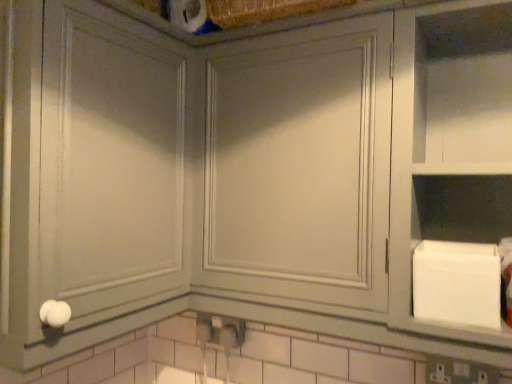
Question: Can you confirm if white matte cabinet at right is taller than matte gray cabinet at center, the first glass door when ordered from right to left?

Choices:
 (A) yes
 (B) no

Answer: (A)

Question: From a real-world perspective, is white matte cabinet at right physically above matte gray cabinet at center, which appears as the 2th glass door when viewed from the left?

Choices:
 (A) yes
 (B) no

Answer: (B)

Question: From the image's perspective, is white matte cabinet at right under matte gray cabinet at center, the first glass door when ordered from right to left?

Choices:
 (A) no
 (B) yes

Answer: (B)

Question: Is white matte cabinet at right positioned in front of matte gray cabinet at center, which appears as the 2th glass door when viewed from the left?

Choices:
 (A) no
 (B) yes

Answer: (B)

Question: Considering the relative sizes of white matte cabinet at right and matte gray cabinet at center, the first glass door when ordered from right to left, in the image provided, is white matte cabinet at right shorter than matte gray cabinet at center, the first glass door when ordered from right to left,?

Choices:
 (A) yes
 (B) no

Answer: (B)

Question: Based on their positions, is white matte cabinet at right located to the left or right of matte gray cabinet at center, which appears as the 2th glass door when viewed from the left?

Choices:
 (A) right
 (B) left

Answer: (A)

Question: Relative to matte gray cabinet at center, which appears as the 2th glass door when viewed from the left, is white matte cabinet at right in front or behind?

Choices:
 (A) behind
 (B) front

Answer: (B)

Question: From the image's perspective, is white matte cabinet at right above or below matte gray cabinet at center, the first glass door when ordered from right to left?

Choices:
 (A) above
 (B) below

Answer: (B)

Question: Is white matte cabinet at right taller or shorter than matte gray cabinet at center, which appears as the 2th glass door when viewed from the left?

Choices:
 (A) tall
 (B) short

Answer: (A)

Question: From a real-world perspective, relative to matte gray cabinet at center, the 2th glass door when ordered from right to left, is matte gray cabinet at center, which appears as the 2th glass door when viewed from the left, vertically above or below?

Choices:
 (A) below
 (B) above

Answer: (B)

Question: Relative to matte gray cabinet at center, the 1th glass door from the left, is matte gray cabinet at center, which appears as the 2th glass door when viewed from the left, in front or behind?

Choices:
 (A) behind
 (B) front

Answer: (A)

Question: Considering the positions of matte gray cabinet at center, the first glass door when ordered from right to left, and matte gray cabinet at center, the 1th glass door from the left, in the image, is matte gray cabinet at center, the first glass door when ordered from right to left, wider or thinner than matte gray cabinet at center, the 1th glass door from the left,?

Choices:
 (A) thin
 (B) wide

Answer: (A)

Question: Does point (303, 218) appear closer or farther from the camera than point (135, 114)?

Choices:
 (A) farther
 (B) closer

Answer: (A)

Question: Would you say white matte cabinet at right is to the left or to the right of matte gray cabinet at center, the 1th glass door from the left, in the picture?

Choices:
 (A) right
 (B) left

Answer: (A)

Question: In terms of size, does white matte cabinet at right appear bigger or smaller than matte gray cabinet at center, the 2th glass door when ordered from right to left?

Choices:
 (A) small
 (B) big

Answer: (A)